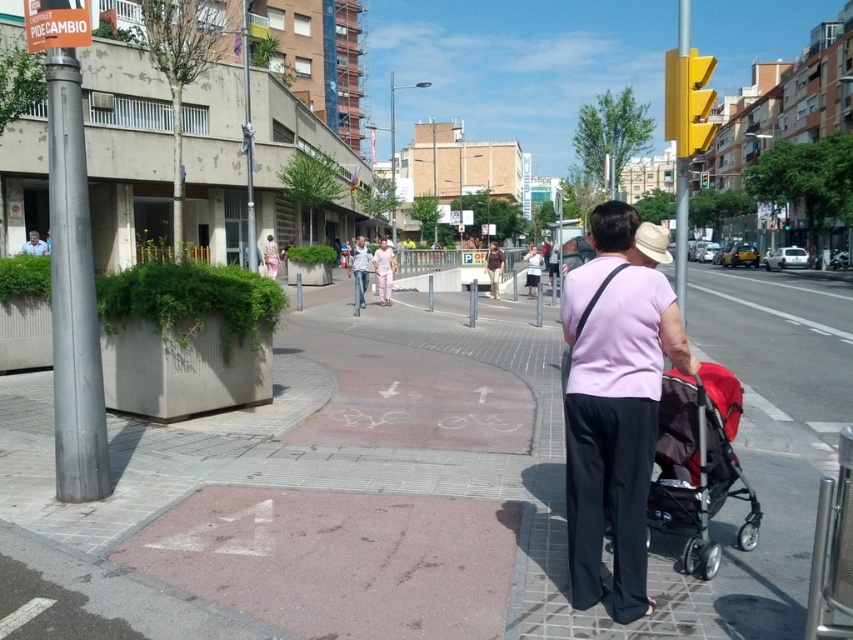
Does light pink fabric shirt at center appear over light blue jeans at center?

Correct, light pink fabric shirt at center is located above light blue jeans at center.

Does light pink fabric shirt at center appear on the left side of light blue jeans at center?

Incorrect, light pink fabric shirt at center is not on the left side of light blue jeans at center.

Which is behind, point (380, 285) or point (364, 304)?

Point (380, 285)

Where is `light pink fabric shirt at center`? Image resolution: width=853 pixels, height=640 pixels. light pink fabric shirt at center is located at coordinates (384, 269).

Can you confirm if pink concrete pavement at center is thinner than pink fabric pants at center?

In fact, pink concrete pavement at center might be wider than pink fabric pants at center.

Is point (431, 458) more distant than point (267, 248)?

That is False.

Find the location of a particular element. This screenshot has width=853, height=640. pink concrete pavement at center is located at coordinates (412, 484).

Is light brown leather jacket at center bigger than pink fabric pants at center?

Yes.

Is light brown leather jacket at center smaller than pink fabric pants at center?

No.

This screenshot has height=640, width=853. In order to click on light brown leather jacket at center in this screenshot , I will do `click(494, 268)`.

Locate an element on the screen. light brown leather jacket at center is located at coordinates (494, 268).